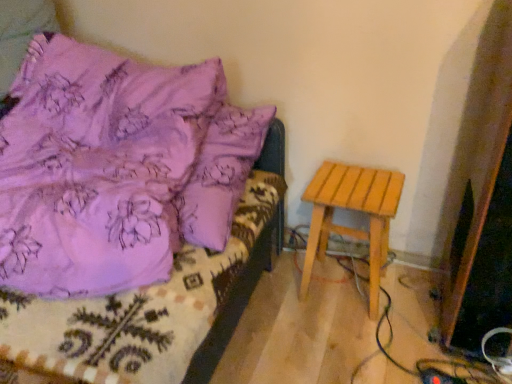
Question: Is purple fabric bed at upper left in front of or behind light brown wooden stool at right in the image?

Choices:
 (A) behind
 (B) front

Answer: (B)

Question: Considering the positions of point (70, 127) and point (318, 201), is point (70, 127) closer or farther from the camera than point (318, 201)?

Choices:
 (A) farther
 (B) closer

Answer: (B)

Question: In terms of width, does purple fabric bed at upper left look wider or thinner when compared to light brown wooden stool at right?

Choices:
 (A) thin
 (B) wide

Answer: (B)

Question: From a real-world perspective, relative to purple fabric bed at upper left, is light brown wooden stool at right vertically above or below?

Choices:
 (A) above
 (B) below

Answer: (B)

Question: In terms of size, does light brown wooden stool at right appear bigger or smaller than purple fabric bed at upper left?

Choices:
 (A) small
 (B) big

Answer: (A)

Question: Which is correct: light brown wooden stool at right is inside purple fabric bed at upper left, or outside of it?

Choices:
 (A) inside
 (B) outside

Answer: (B)

Question: From the image's perspective, is light brown wooden stool at right located above or below purple fabric bed at upper left?

Choices:
 (A) above
 (B) below

Answer: (B)